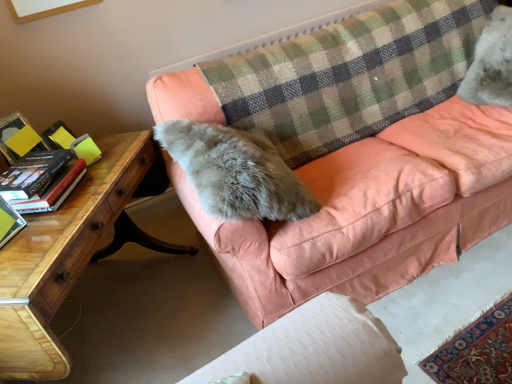
Question: Is the position of white fluffy cat at upper right less distant than that of hardcover book at left, marked as the 2th paperback book in a front-to-back arrangement?

Choices:
 (A) no
 (B) yes

Answer: (A)

Question: Does white fluffy cat at upper right appear on the right side of hardcover book at left, the first paperback book viewed from the back?

Choices:
 (A) no
 (B) yes

Answer: (B)

Question: Can you confirm if white fluffy cat at upper right is taller than hardcover book at left, the first paperback book viewed from the back?

Choices:
 (A) no
 (B) yes

Answer: (B)

Question: From the image's perspective, would you say white fluffy cat at upper right is shown under hardcover book at left, the first paperback book viewed from the back?

Choices:
 (A) no
 (B) yes

Answer: (A)

Question: Can you confirm if white fluffy cat at upper right is positioned to the left of hardcover book at left, the first paperback book viewed from the back?

Choices:
 (A) no
 (B) yes

Answer: (A)

Question: Does white fluffy cat at upper right have a greater width compared to hardcover book at left, the first paperback book viewed from the back?

Choices:
 (A) no
 (B) yes

Answer: (B)

Question: From a real-world perspective, is checkered fabric plaid at upper center located beneath green matte book at left, positioned as the 1th paperback book in front-to-back order?

Choices:
 (A) no
 (B) yes

Answer: (B)

Question: Is checkered fabric plaid at upper center shorter than green matte book at left, which ranks as the 2th paperback book in back-to-front order?

Choices:
 (A) yes
 (B) no

Answer: (B)

Question: Does checkered fabric plaid at upper center lie in front of green matte book at left, positioned as the 1th paperback book in front-to-back order?

Choices:
 (A) yes
 (B) no

Answer: (B)

Question: Could you tell me if checkered fabric plaid at upper center is facing green matte book at left, positioned as the 1th paperback book in front-to-back order?

Choices:
 (A) yes
 (B) no

Answer: (B)

Question: Are checkered fabric plaid at upper center and green matte book at left, positioned as the 1th paperback book in front-to-back order, making contact?

Choices:
 (A) no
 (B) yes

Answer: (A)

Question: Can you confirm if checkered fabric plaid at upper center is smaller than green matte book at left, which ranks as the 2th paperback book in back-to-front order?

Choices:
 (A) no
 (B) yes

Answer: (A)

Question: Does green matte book at left, which ranks as the 2th paperback book in back-to-front order, have a greater height compared to wooden desk at lower left?

Choices:
 (A) yes
 (B) no

Answer: (B)